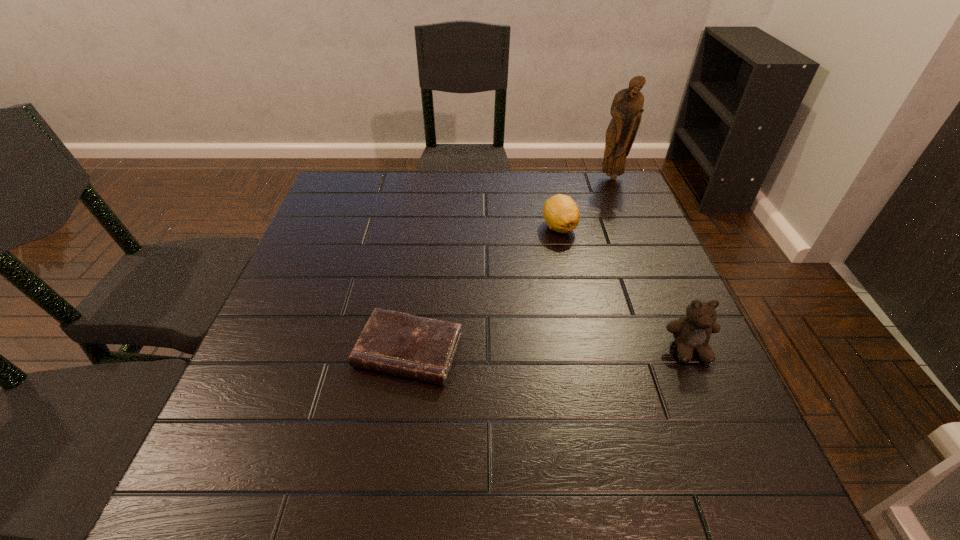
Identify the location of vacant area that lies between the tallest object and the second tallest object. The width and height of the screenshot is (960, 540). (651, 264).

Locate an element on the screen. The height and width of the screenshot is (540, 960). vacant space that is in between the tallest object and the third nearest object is located at coordinates (586, 202).

Where is `free space between the shortest object and the teddy bear`? Image resolution: width=960 pixels, height=540 pixels. free space between the shortest object and the teddy bear is located at coordinates (549, 350).

Where is `empty space that is in between the diary and the third shortest object`? This screenshot has height=540, width=960. empty space that is in between the diary and the third shortest object is located at coordinates (549, 350).

Image resolution: width=960 pixels, height=540 pixels. I want to click on vacant region between the leftmost object and the third tallest object, so click(484, 289).

Identify which object is the third closest to the figurine. Please provide its 2D coordinates. Your answer should be formatted as a tuple, i.e. [(x, y)], where the tuple contains the x and y coordinates of a point satisfying the conditions above.

[(395, 343)]

Identify the location of object that is the closest to the third shortest object. (561, 213).

Locate an element on the screen. Image resolution: width=960 pixels, height=540 pixels. blank area in the image that satisfies the following two spatial constraints: 1. on the back side of the farthest object; 2. on the right side of the shortest object is located at coordinates (434, 178).